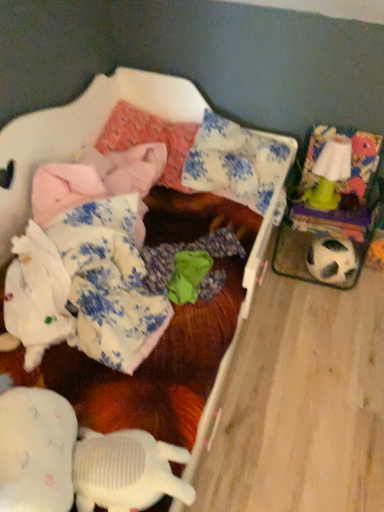
Where is `free space to the left of black and white textured football at right`? The width and height of the screenshot is (384, 512). free space to the left of black and white textured football at right is located at coordinates (291, 277).